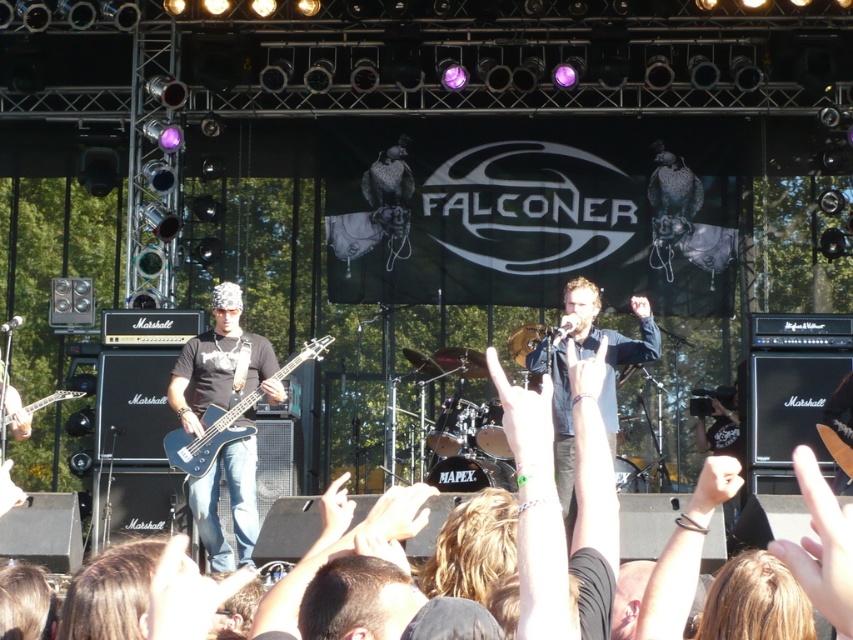
You are a photographer at the Falconer concert. You need to capture a photo that includes both the Marshall amplifier and the lead singer. The stage has two points marked for optimal lighting. The first point is at coordinate point[247,372] and the second at point[201,451]. Which point should you choose to ensure both subjects are in focus and properly lit?

You should choose point[247,372] because it is closer to the photographer, ensuring both the Marshall amplifier and the lead singer are in focus and properly lit.

You are standing at the point marked as point (573, 460) in the image. The stage is 150 feet away from you. Can you reach the stage from your current position without moving forward?

The distance of point (573, 460) from viewer is 152.66 feet, so you are 2.66 feet away from the stage. Since you need to move forward to reach it, you cannot reach the stage without moving forward.

You are a photographer at the Falconer concert. You want to capture a closeup of the matte black guitar at left. The stage is divided into sections with coordinates from 0 to 1. The guitar is located at point (219, 364). If you position your camera at point 0.5, 0.5, will you be able to focus on the guitar without any obstructions?

The point (219, 364) corresponds to the matte black guitar at left, so positioning the camera at 0.5, 0.5 would allow focusing on the guitar as there are no obstructions mentioned in the scene description.